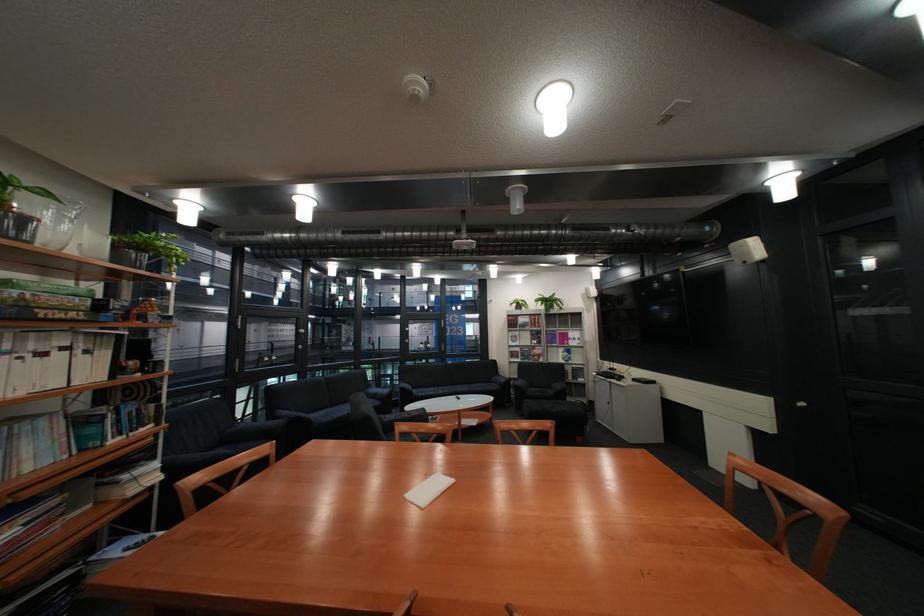
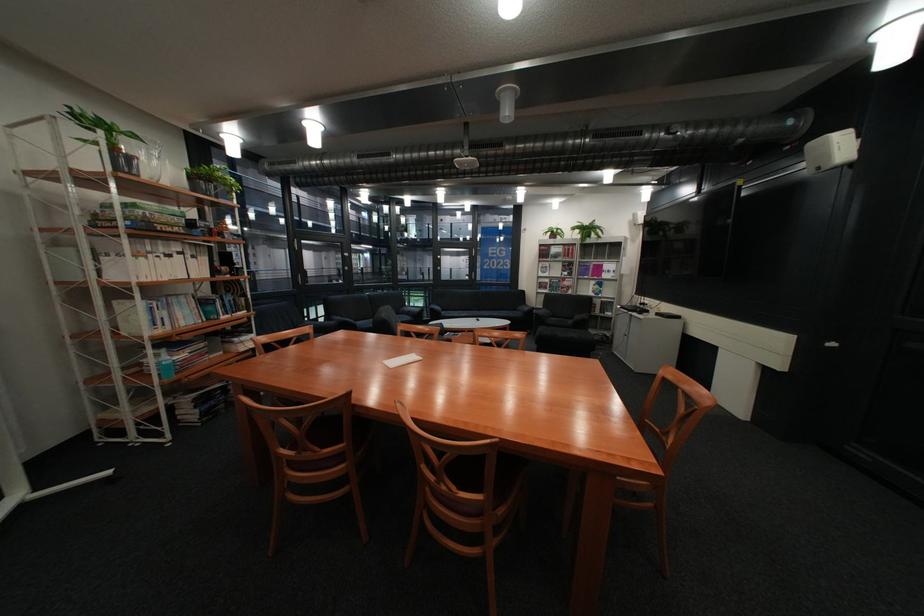
The point at (390,397) is marked in the first image. Where is the corresponding point in the second image?

(423, 313)